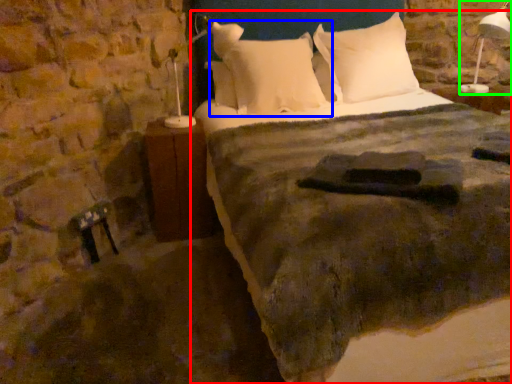
Question: Which object is the farthest from bed (highlighted by a red box)? Choose among these: pillow (highlighted by a blue box) or bedside lamp (highlighted by a green box).

Choices:
 (A) pillow
 (B) bedside lamp

Answer: (B)